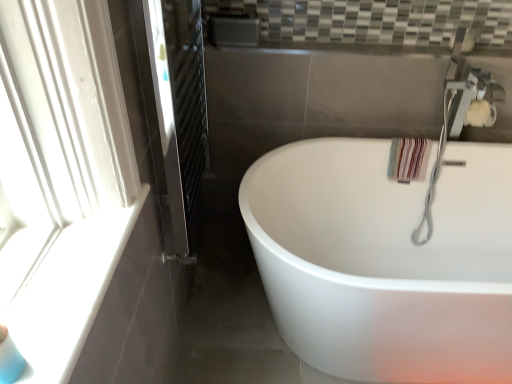
I want to click on vacant space underneath clear glass screen door at left (from a real-world perspective), so click(x=206, y=286).